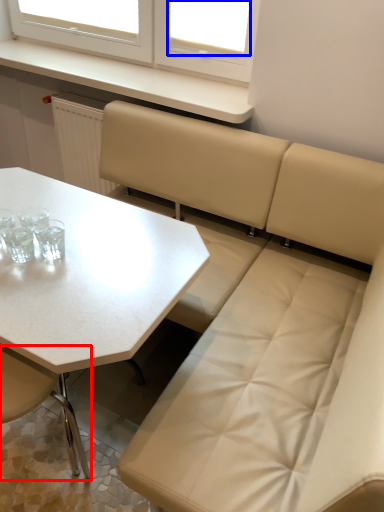
Question: Which object is closer to the camera taking this photo, chair (highlighted by a red box) or window screen (highlighted by a blue box)?

Choices:
 (A) chair
 (B) window screen

Answer: (A)